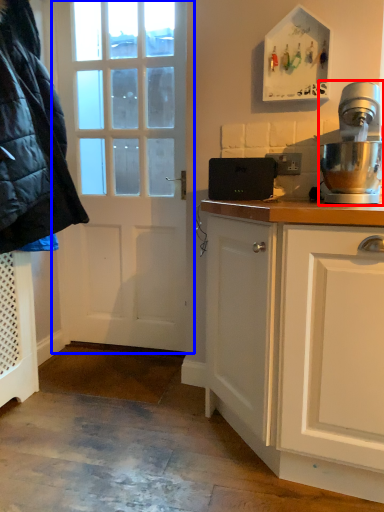
Question: Which of the following is the farthest to the observer, home appliance (highlighted by a red box) or door (highlighted by a blue box)?

Choices:
 (A) home appliance
 (B) door

Answer: (B)